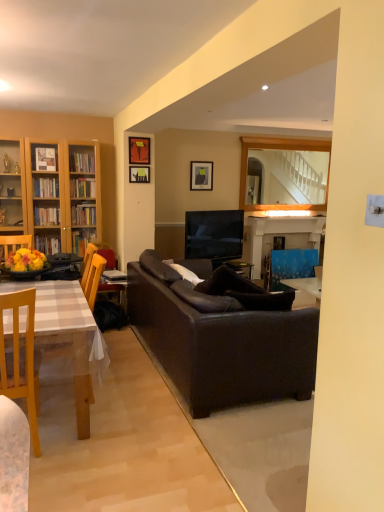
Question: Considering their positions, is hardcover book at center located in front of or behind matte black picture frame at upper center, arranged as the third picture frame when viewed from the front?

Choices:
 (A) front
 (B) behind

Answer: (A)

Question: Looking at the image, does hardcover book at center seem bigger or smaller compared to matte black picture frame at upper center, which is counted as the first picture frame, starting from the back?

Choices:
 (A) big
 (B) small

Answer: (B)

Question: Which of these objects is positioned closest to the wooden chair at left?

Choices:
 (A) blue glossy armchair at right, which is the 2th armchair in front-to-back order
 (B) matte black picture frame at upper center, which is the 1th picture frame from right to left
 (C) blue painted wood fireplace at center
 (D) matte black picture frame at upper center, the 2th picture frame in the front-to-back sequence
 (E) dark brown leather couch at center

Answer: (E)

Question: Which is farther from the hardcover book at center?

Choices:
 (A) brown leather armchair at left, arranged as the 2th armchair when viewed from the right
 (B) blue glossy armchair at right, placed as the first armchair when sorted from back to front
 (C) matte black picture frame at upper center, the 2th picture frame in the front-to-back sequence
 (D) matte black picture frame at upper center, arranged as the third picture frame when viewed from the front
 (E) wooden mirror at upper center

Answer: (E)